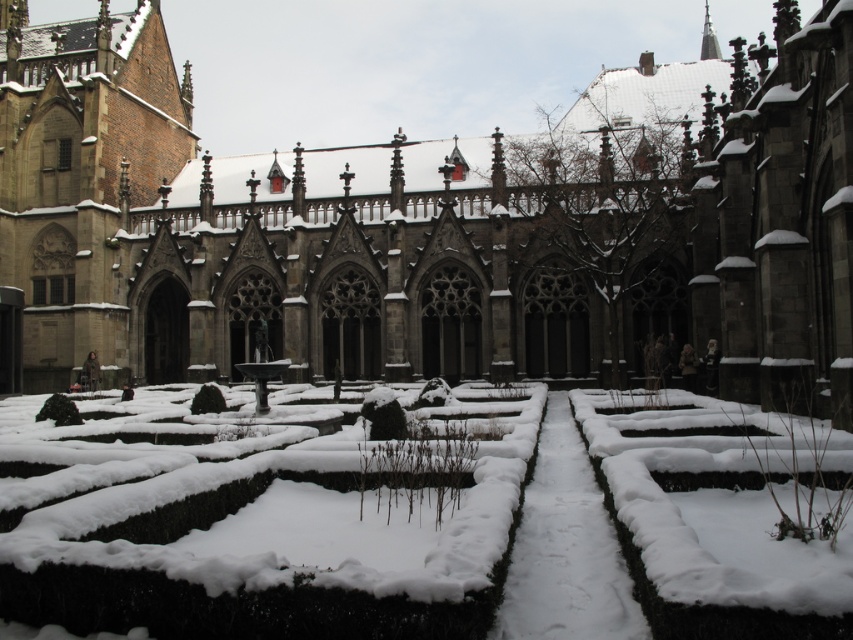
Is green leafy hedge at lower left to the right of green matte hedge at center from the viewer's perspective?

Incorrect, green leafy hedge at lower left is not on the right side of green matte hedge at center.

Does point (73, 412) come farther from viewer compared to point (198, 410)?

No, it is not.

The width and height of the screenshot is (853, 640). Identify the location of green leafy hedge at lower left. click(59, 410).

Which of these two, dark gray stone church at center or green leafy hedge at lower left, stands shorter?

green leafy hedge at lower left is shorter.

The width and height of the screenshot is (853, 640). I want to click on dark gray stone church at center, so click(434, 225).

Is point (231, 298) positioned before point (51, 408)?

No, it is behind (51, 408).

Identify the location of dark gray stone church at center. Image resolution: width=853 pixels, height=640 pixels. (434, 225).

Who is more forward, (90, 100) or (218, 396)?

Point (218, 396) is more forward.

What are the coordinates of `dark gray stone church at center` in the screenshot? It's located at (434, 225).